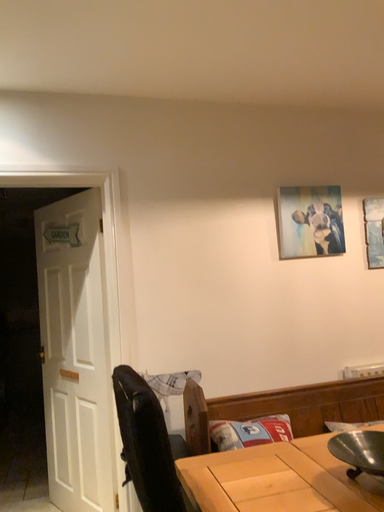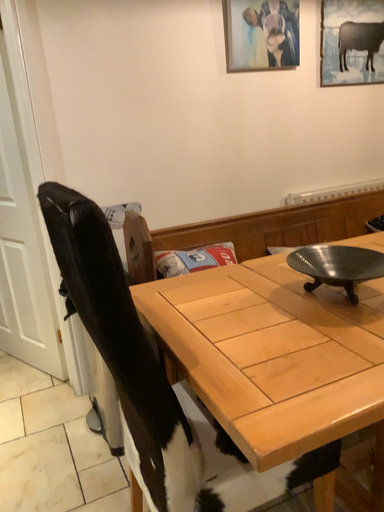
Question: How did the camera likely rotate when shooting the video?

Choices:
 (A) rotated downward
 (B) rotated upward

Answer: (A)